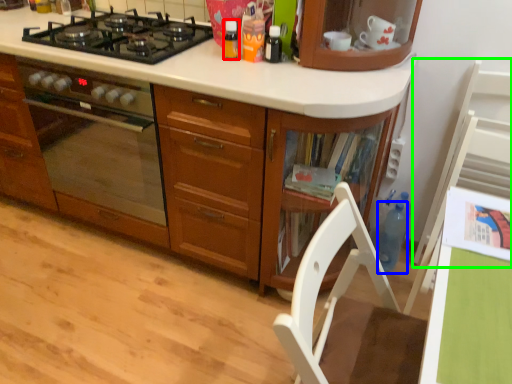
Question: Which object is the farthest from kitchen appliance (highlighted by a red box)? Choose among these: bottle (highlighted by a blue box) or chair (highlighted by a green box).

Choices:
 (A) bottle
 (B) chair

Answer: (A)